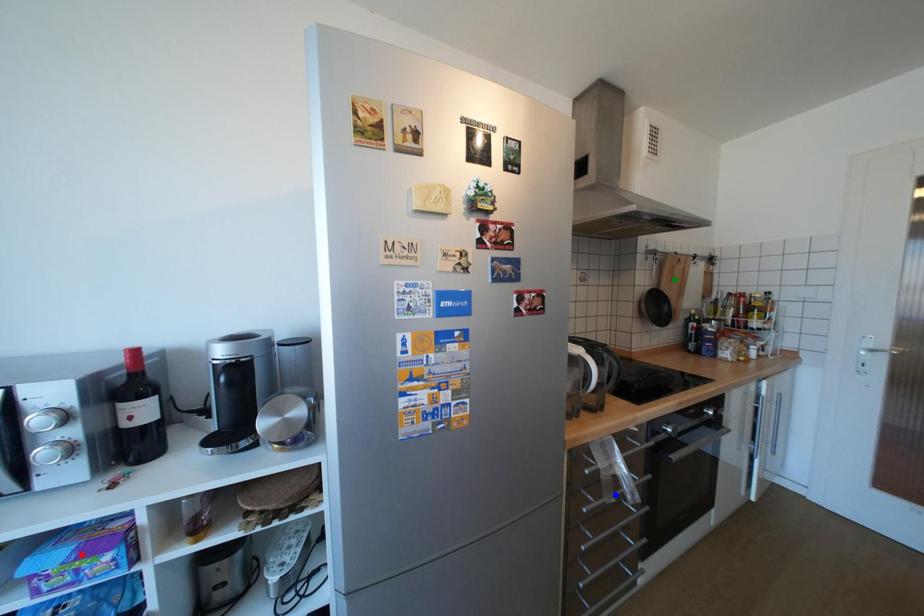
Order these from nearest to farthest:
- blue point
- red point
- green point

red point < blue point < green point